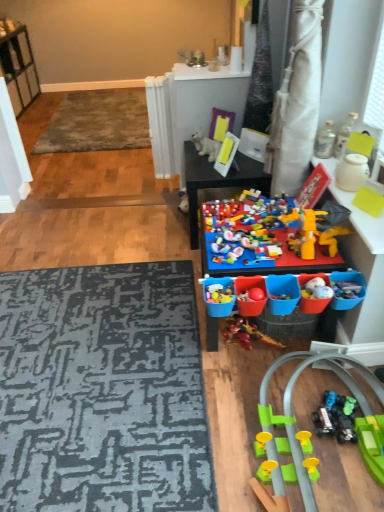
Question: Is multicolored plastic toy at center, the sixth toy positioned from the top, taller than translucent glass bottle at upper right, which is the 2th toy in top-to-bottom order?

Choices:
 (A) no
 (B) yes

Answer: (B)

Question: Is multicolored plastic toy at center, the sixth toy positioned from the top, next to translucent glass bottle at upper right, which is the 2th toy in top-to-bottom order, and touching it?

Choices:
 (A) yes
 (B) no

Answer: (B)

Question: Is multicolored plastic toy at center, the 2th toy positioned from the bottom, bigger than translucent glass bottle at upper right, which is the 2th toy in top-to-bottom order?

Choices:
 (A) no
 (B) yes

Answer: (B)

Question: Is translucent glass bottle at upper right, the sixth toy in the bottom-to-top sequence, surrounded by multicolored plastic toy at center, the 2th toy positioned from the bottom?

Choices:
 (A) no
 (B) yes

Answer: (A)

Question: Is multicolored plastic toy at center, the sixth toy positioned from the top, facing away from translucent glass bottle at upper right, which is the 2th toy in top-to-bottom order?

Choices:
 (A) yes
 (B) no

Answer: (B)

Question: Is multicolored plastic toy at center to the left or to the right of white plastic shelf at upper left in the image?

Choices:
 (A) right
 (B) left

Answer: (A)

Question: Is multicolored plastic toy at center taller or shorter than white plastic shelf at upper left?

Choices:
 (A) tall
 (B) short

Answer: (B)

Question: Considering the positions of multicolored plastic toy at center and white plastic shelf at upper left in the image, is multicolored plastic toy at center bigger or smaller than white plastic shelf at upper left?

Choices:
 (A) small
 (B) big

Answer: (A)

Question: Would you say multicolored plastic toy at center is inside or outside white plastic shelf at upper left?

Choices:
 (A) inside
 (B) outside

Answer: (B)

Question: In terms of height, does textured gray rug at upper left, the 1th mat viewed from the top, look taller or shorter compared to multicolored plastic toy at center, the 2th toy positioned from the bottom?

Choices:
 (A) tall
 (B) short

Answer: (B)

Question: From the image's perspective, relative to multicolored plastic toy at center, the sixth toy positioned from the top, is textured gray rug at upper left, the 2th mat positioned from the front, above or below?

Choices:
 (A) below
 (B) above

Answer: (B)

Question: From a real-world perspective, is textured gray rug at upper left, the 1th mat viewed from the top, physically located above or below multicolored plastic toy at center, the 2th toy positioned from the bottom?

Choices:
 (A) below
 (B) above

Answer: (A)

Question: Considering the positions of textured gray rug at upper left, the 1th mat viewed from the top, and multicolored plastic toy at center, the sixth toy positioned from the top, in the image, is textured gray rug at upper left, the 1th mat viewed from the top, bigger or smaller than multicolored plastic toy at center, the sixth toy positioned from the top,?

Choices:
 (A) small
 (B) big

Answer: (B)

Question: Is white plastic shelf at upper left to the left or to the right of white plastic dog at center, which appears as the first toy when viewed from the top, in the image?

Choices:
 (A) left
 (B) right

Answer: (A)

Question: Is white plastic shelf at upper left taller or shorter than white plastic dog at center, which appears as the first toy when viewed from the top?

Choices:
 (A) tall
 (B) short

Answer: (A)